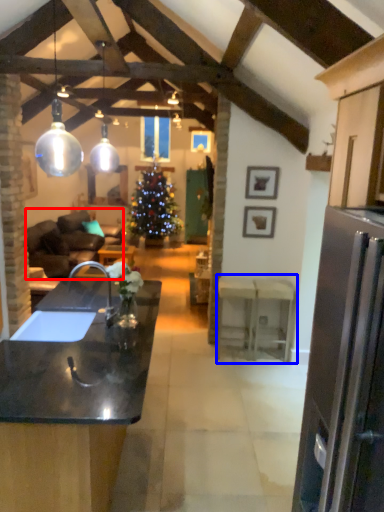
Question: Which of the following is the farthest to the observer, studio couch (highlighted by a red box) or table (highlighted by a blue box)?

Choices:
 (A) studio couch
 (B) table

Answer: (A)